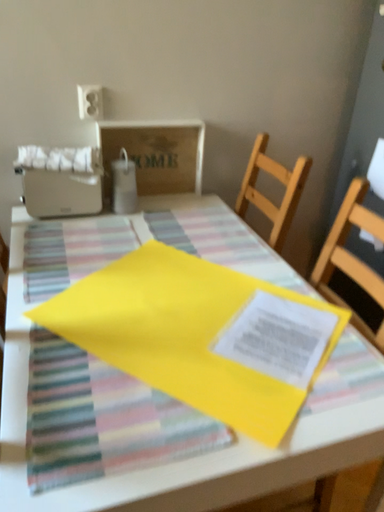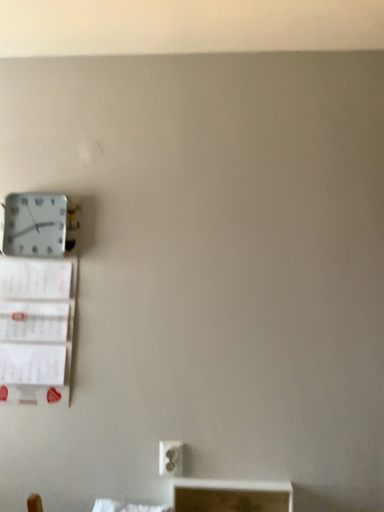
Question: How did the camera likely rotate when shooting the video?

Choices:
 (A) rotated left
 (B) rotated right

Answer: (A)